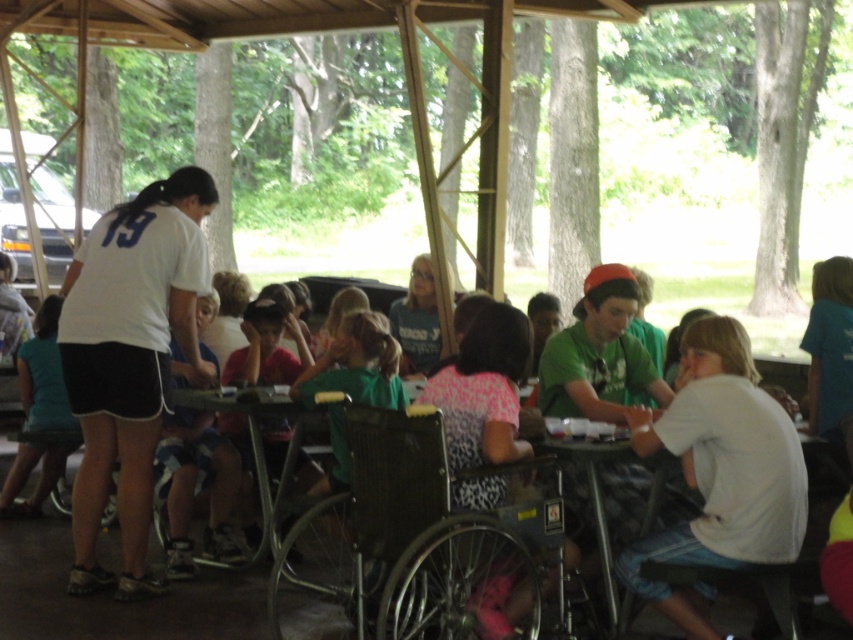
Question: Is white cotton shirt at lower right wider than green plastic table at center?

Choices:
 (A) no
 (B) yes

Answer: (A)

Question: Is light blue shirt at left thinner than green plastic table at center?

Choices:
 (A) no
 (B) yes

Answer: (B)

Question: Which of the following is the closest to the observer?

Choices:
 (A) (402, 592)
 (B) (73, 541)

Answer: (A)

Question: Where is metallic gray wheelchair at center located in relation to white cotton shirt at lower right in the image?

Choices:
 (A) above
 (B) below

Answer: (B)

Question: Which object is closer to the camera taking this photo?

Choices:
 (A) light blue shirt at left
 (B) white cotton shirt at lower right
 (C) white matte shirt at center

Answer: (B)

Question: Which object is the farthest from the white cotton shirt at lower right?

Choices:
 (A) metallic gray wheelchair at center
 (B) green plastic table at center
 (C) light blue shirt at left
 (D) white matte shirt at center

Answer: (C)